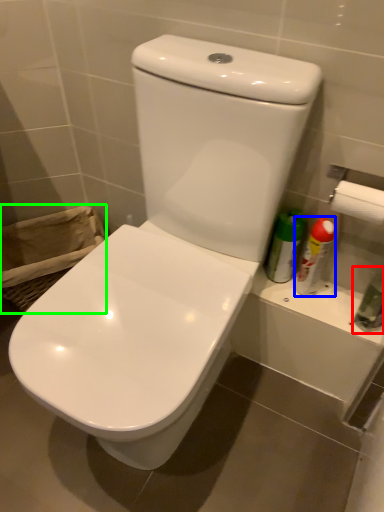
Question: Which object is the closest to the toiletry (highlighted by a red box)? Choose among these: cleaning product (highlighted by a blue box) or laundry basket (highlighted by a green box).

Choices:
 (A) cleaning product
 (B) laundry basket

Answer: (A)